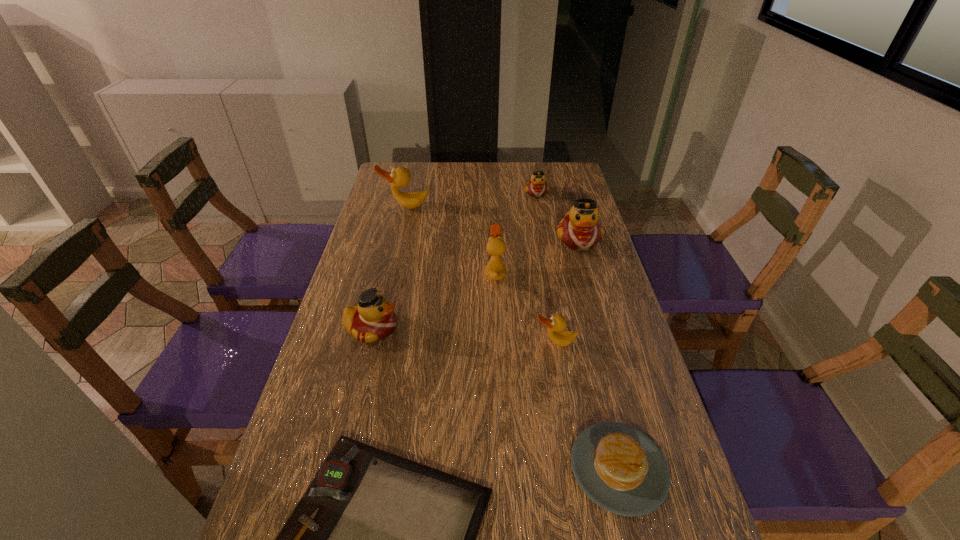
This screenshot has width=960, height=540. Identify the location of the fourth nearest duck. (580, 230).

Find the location of a particular element. The height and width of the screenshot is (540, 960). the second nearest red duck is located at coordinates (580, 230).

Where is `the farthest tan duck`? This screenshot has width=960, height=540. the farthest tan duck is located at coordinates (399, 177).

The image size is (960, 540). I want to click on the leftmost tan duck, so click(399, 177).

You are a GUI agent. You are given a task and a screenshot of the screen. Output one action in this format:
    pyautogui.click(x=<x>, y=<y>)
    Task: Click on the second smallest red duck
    This screenshot has width=960, height=540.
    Given the screenshot: What is the action you would take?
    pyautogui.click(x=373, y=319)

Locate an element on the screen. the leftmost red duck is located at coordinates (373, 319).

Where is `the second tan duck from left to right`? the second tan duck from left to right is located at coordinates (495, 269).

The image size is (960, 540). Find the location of `the third duck from left to right`. the third duck from left to right is located at coordinates (495, 269).

Where is `the farthest duck`? the farthest duck is located at coordinates (537, 187).

Identify the location of the farthest red duck. Image resolution: width=960 pixels, height=540 pixels. (537, 187).